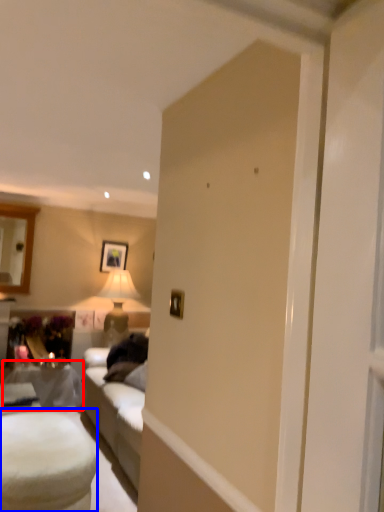
Question: Which object is further to the camera taking this photo, table (highlighted by a red box) or table (highlighted by a blue box)?

Choices:
 (A) table
 (B) table

Answer: (A)